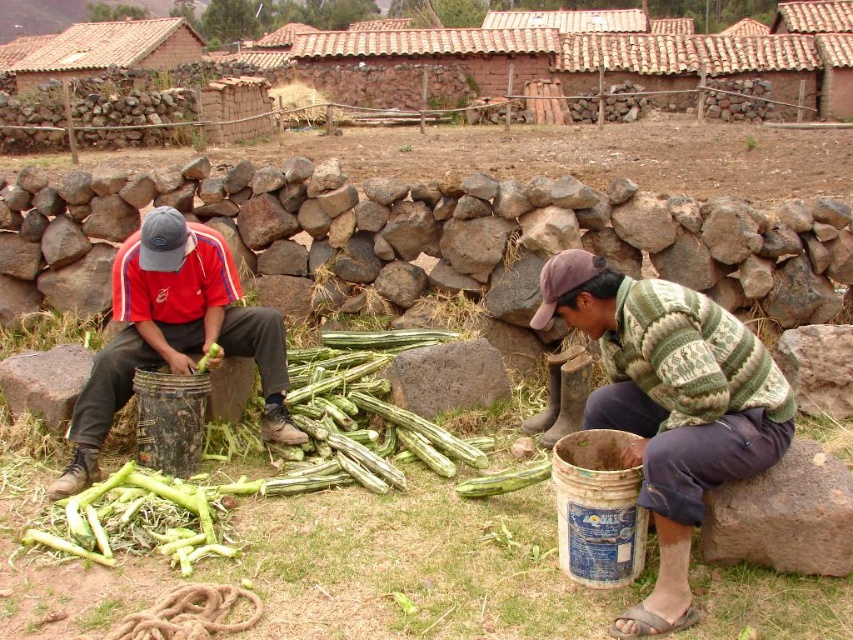
You are a farmer who needs to place the matte black bucket at left closer to the green rough vegetable at center. How much distance do you need to move the bucket to make them touch each other?

The matte black bucket at left is currently 24.44 inches away from the green rough vegetable at center. To make them touch, you need to move the bucket by 24.44 inches towards the vegetable.